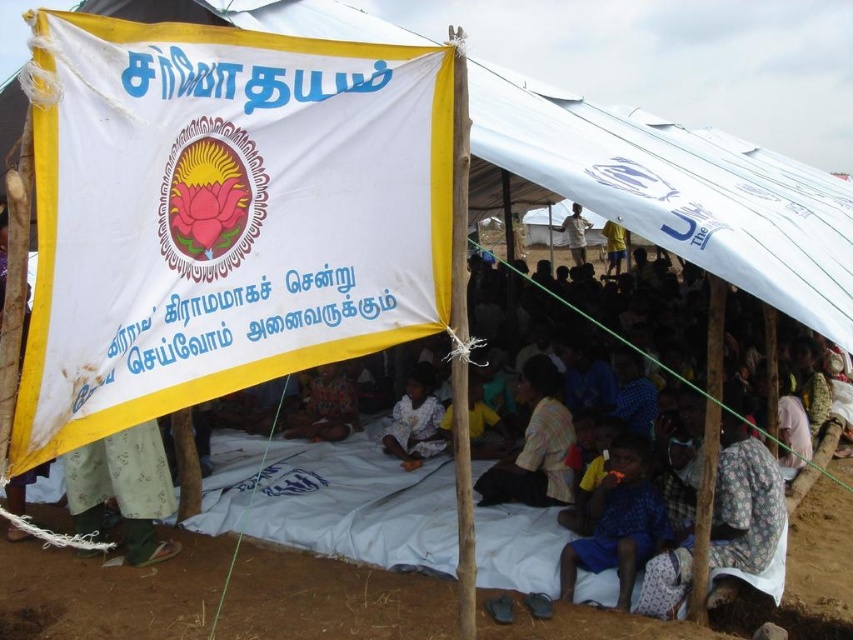
Is point (625, 509) closer to viewer compared to point (427, 452)?

That is True.

At what (x,y) coordinates should I click in order to perform the action: click on dark blue fabric at lower center. Please return your answer as a coordinate pair (x, y). This screenshot has width=853, height=640. Looking at the image, I should click on (619, 522).

Locate an element on the screen. dark blue fabric at lower center is located at coordinates (619, 522).

Is light brown wooden pole at center below yellow fabric shorts at center?

Actually, light brown wooden pole at center is above yellow fabric shorts at center.

Who is more forward, (579,230) or (614,257)?

Positioned in front is point (614,257).

What do you see at coordinates (576, 234) in the screenshot?
I see `light brown wooden pole at center` at bounding box center [576, 234].

Identify the location of light brown wooden pole at center. This screenshot has height=640, width=853. (576, 234).

Who is more forward, [618,449] or [320,424]?

Point [618,449] is more forward.

Is dark blue fabric at lower center above printed fabric child at center?

No, dark blue fabric at lower center is not above printed fabric child at center.

Identify the location of dark blue fabric at lower center. (619, 522).